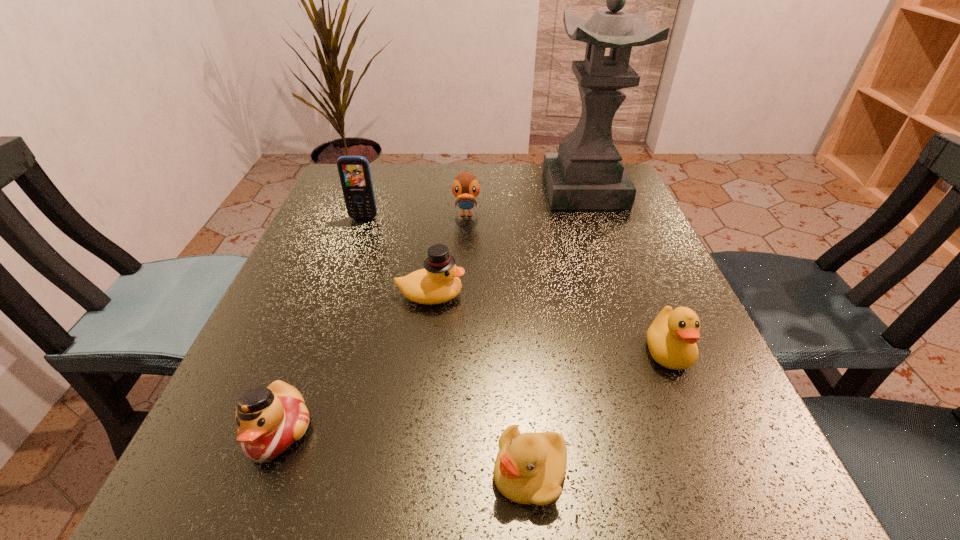
The height and width of the screenshot is (540, 960). Identify the location of vacant space located 0.200m on the screen of the second tallest object. (342, 279).

The height and width of the screenshot is (540, 960). I want to click on vacant space located 0.250m on the front-facing side of the second farthest duck, so click(x=602, y=295).

This screenshot has width=960, height=540. Identify the location of vacant space located at the beak of the second nearest duck. (727, 498).

Find the location of a particular element. The height and width of the screenshot is (540, 960). vacant space positioned 0.100m on the front-facing side of the farthest duck is located at coordinates (465, 252).

At what (x,y) coordinates should I click in order to perform the action: click on free region located on the beak of the duckling. Please return your answer as a coordinate pair (x, y). Looking at the image, I should click on (203, 472).

The width and height of the screenshot is (960, 540). I want to click on vacant space located 0.140m on the beak of the duckling, so click(x=383, y=472).

The width and height of the screenshot is (960, 540). Identify the location of vacant region located on the beak of the duckling. (304, 472).

The width and height of the screenshot is (960, 540). Find the location of `sculpture situated at the far edge`. sculpture situated at the far edge is located at coordinates (587, 172).

The height and width of the screenshot is (540, 960). Identify the location of duck at the far edge. (465, 187).

Locate an element on the screen. duck situated at the near edge is located at coordinates (270, 420).